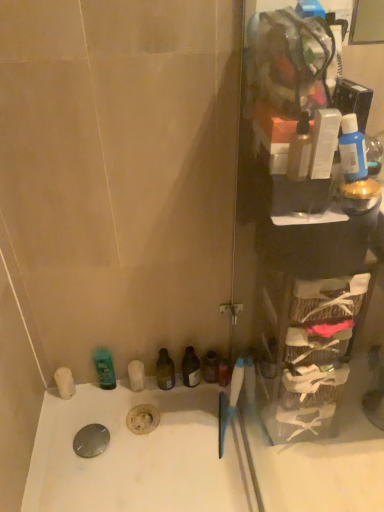
Question: Should I look upward or downward to see white plastic bottle at upper right, the 1th toiletry in the top-to-bottom sequence?

Choices:
 (A) down
 (B) up

Answer: (B)

Question: Would you consider white plastic bottle at upper right, the 1th toiletry in the top-to-bottom sequence, to be distant from blue glossy bottle at upper right, the 5th mouthwash positioned from the left?

Choices:
 (A) no
 (B) yes

Answer: (A)

Question: Considering the relative sizes of white plastic bottle at upper right, the 1th toiletry from the front, and blue glossy bottle at upper right, acting as the 1th mouthwash starting from the right, in the image provided, is white plastic bottle at upper right, the 1th toiletry from the front, smaller than blue glossy bottle at upper right, acting as the 1th mouthwash starting from the right,?

Choices:
 (A) no
 (B) yes

Answer: (B)

Question: From a real-world perspective, is white plastic bottle at upper right, which is the 2th toiletry from back to front, positioned under blue glossy bottle at upper right, acting as the 1th mouthwash starting from the right, based on gravity?

Choices:
 (A) yes
 (B) no

Answer: (B)

Question: Is white plastic bottle at upper right, the 1th toiletry from the front, completely or partially outside of blue glossy bottle at upper right, acting as the 1th mouthwash starting from the right?

Choices:
 (A) yes
 (B) no

Answer: (A)

Question: Considering the relative sizes of white plastic bottle at upper right, the first toiletry positioned from the right, and blue glossy bottle at upper right, which is counted as the 2th mouthwash, starting from the front, in the image provided, is white plastic bottle at upper right, the first toiletry positioned from the right, taller than blue glossy bottle at upper right, which is counted as the 2th mouthwash, starting from the front,?

Choices:
 (A) yes
 (B) no

Answer: (A)

Question: From a real-world perspective, is white plastic bottle at upper right, the 1th toiletry in the top-to-bottom sequence, on top of blue glossy bottle at upper right, the 5th mouthwash positioned from the left?

Choices:
 (A) yes
 (B) no

Answer: (A)

Question: From the image's perspective, is transparent plastic shelf at right located beneath white matte soap at lower left, positioned as the 1th toiletry in back-to-front order?

Choices:
 (A) yes
 (B) no

Answer: (B)

Question: From a real-world perspective, is transparent plastic shelf at right over white matte soap at lower left, positioned as the 1th toiletry in back-to-front order?

Choices:
 (A) no
 (B) yes

Answer: (B)

Question: Could you tell me if transparent plastic shelf at right is facing white matte soap at lower left, which ranks as the 2th toiletry in right-to-left order?

Choices:
 (A) yes
 (B) no

Answer: (B)

Question: Is transparent plastic shelf at right looking in the opposite direction of white matte soap at lower left, which is the 2th toiletry in top-to-bottom order?

Choices:
 (A) no
 (B) yes

Answer: (A)

Question: Is transparent plastic shelf at right taller than white matte soap at lower left, marked as the 1th toiletry in a bottom-to-top arrangement?

Choices:
 (A) yes
 (B) no

Answer: (A)

Question: Considering the relative sizes of transparent plastic shelf at right and white matte soap at lower left, which ranks as the 2th toiletry in right-to-left order, in the image provided, is transparent plastic shelf at right shorter than white matte soap at lower left, which ranks as the 2th toiletry in right-to-left order,?

Choices:
 (A) no
 (B) yes

Answer: (A)

Question: Is white plastic bottle at upper right, the 1th toiletry from the front, at the right side of white matte soap at lower left, which ranks as the 2th toiletry in right-to-left order?

Choices:
 (A) no
 (B) yes

Answer: (B)